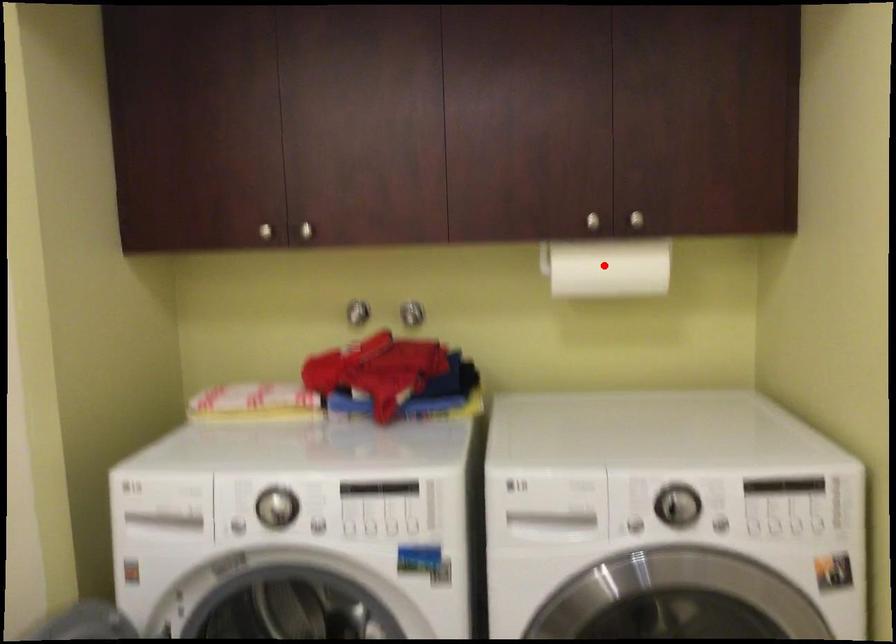
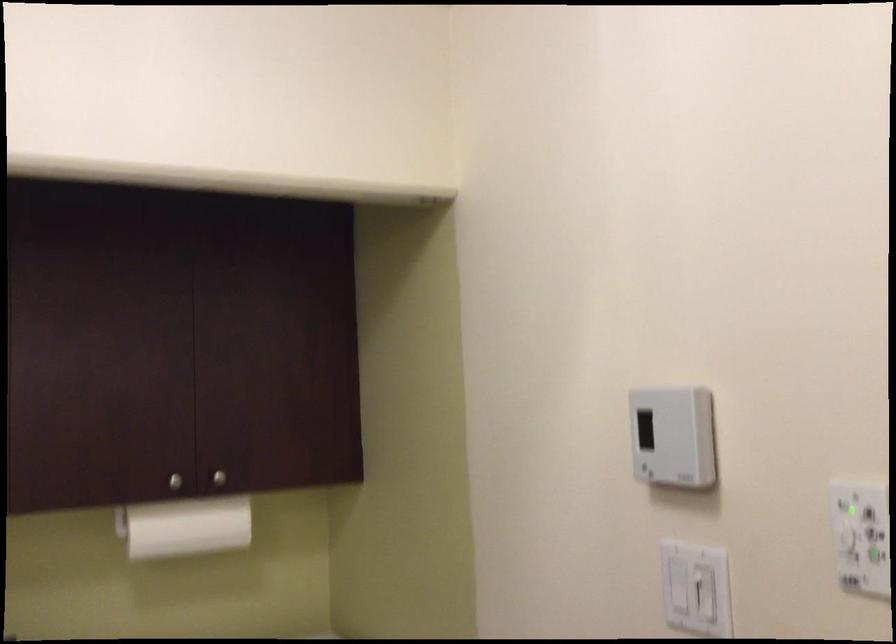
Locate, in the second image, the point that corresponds to the highlighted location in the first image.

(185, 527)